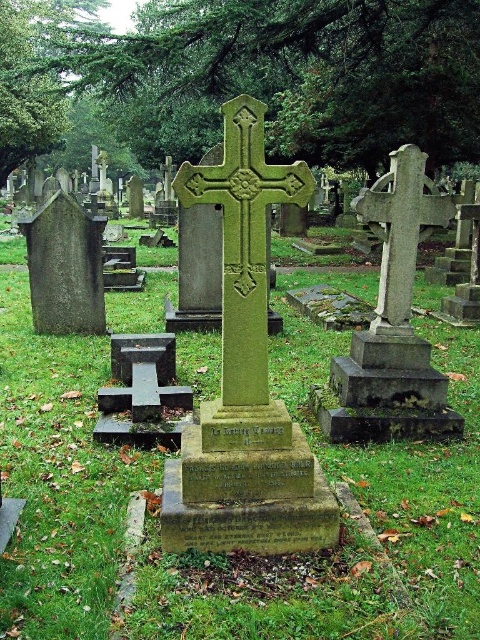
You are standing in the cemetery and want to place a bouquet of flowers on the green stone cross at center. Considering the green grass at center is between you and the cross, how should you position the bouquet relative to the grass?

Since the green grass at center is closer to the viewer than the green stone cross at center, you should place the bouquet on the green stone cross at center behind the green grass at center.

You are standing in the cemetery and want to place a small bouquet of flowers on the green grass at center. However, there is a green stone cross at center in the way. Can you place the bouquet directly on the grass without moving the cross?

The green grass at center is positioned under the green stone cross at center, so placing the bouquet directly on the grass would require moving the cross first.

From the picture: You are a groundskeeper in a cemetery and need to mow the grass around the green stone cross at center. Based on the scene, will you need to adjust your lawnmower height setting to accommodate the green grass at center compared to other areas?

The green grass at center is much taller than the green stone cross at center, so you will need to lower your lawnmower height to cut the taller grass at the center.